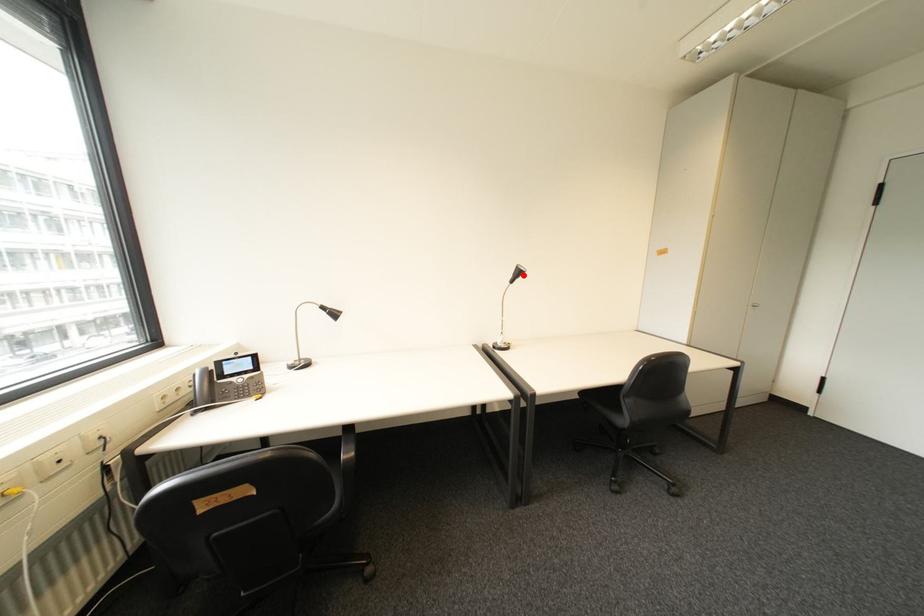
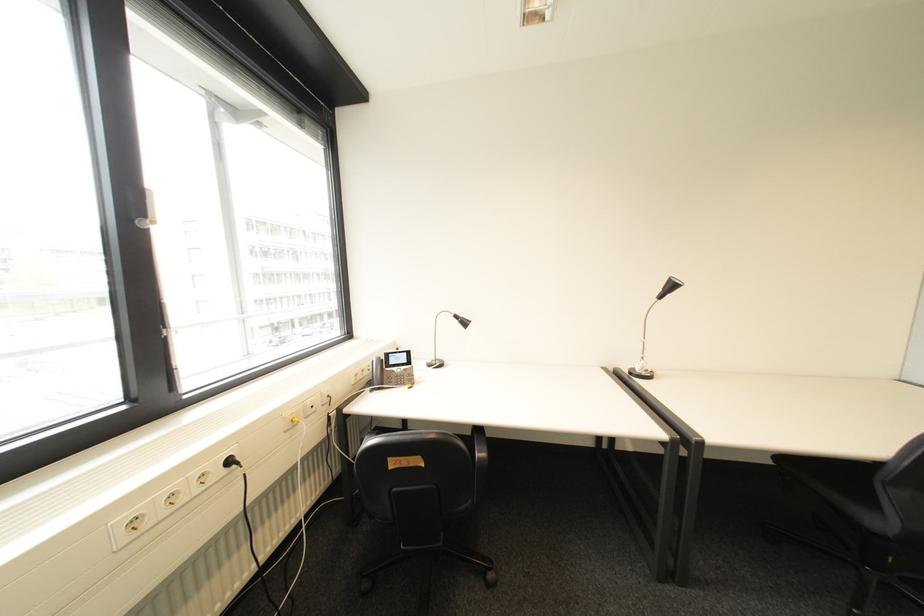
Find the pixel in the second image that matches the highlighted location in the first image.

(673, 290)